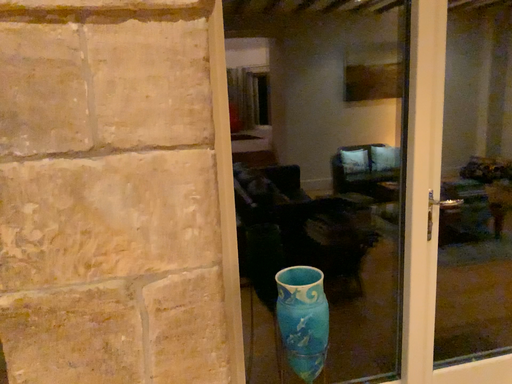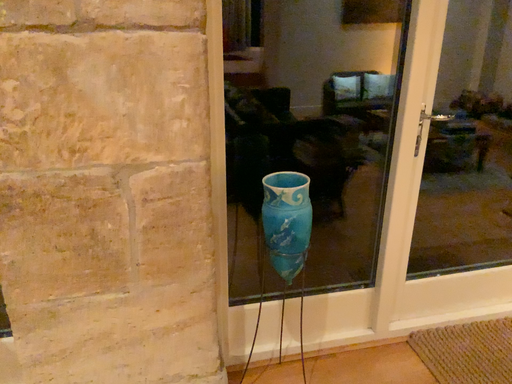
Question: Which way did the camera rotate in the video?

Choices:
 (A) rotated downward
 (B) rotated upward

Answer: (A)